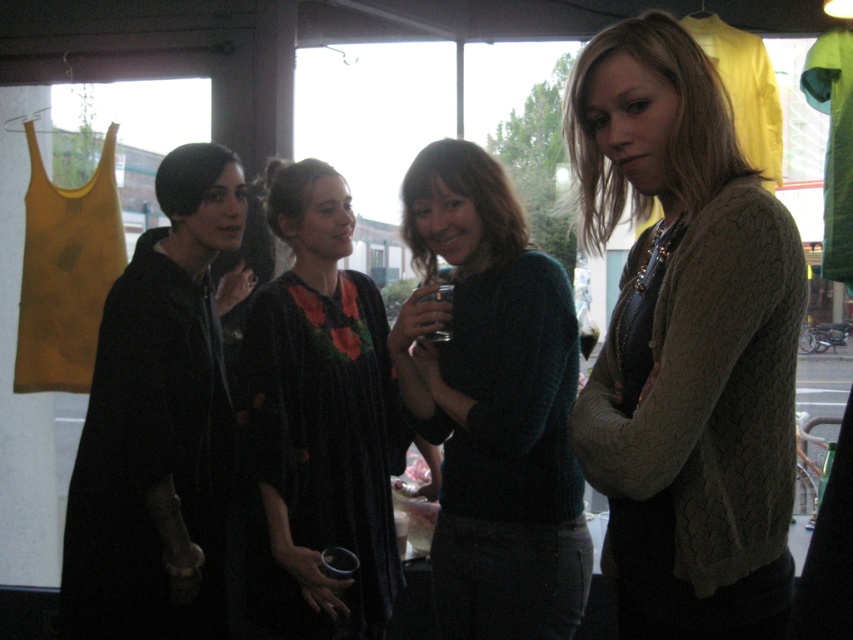
Question: Which object is positioned farthest from the metallic silver cup at center?

Choices:
 (A) knitted teal sweater at center
 (B) cable-knit sweater at center

Answer: (B)

Question: Which point is closer to the camera?

Choices:
 (A) velvet black dress at center
 (B) knitted teal sweater at center

Answer: (B)

Question: Does velvet black dress at center have a lesser width compared to metallic silver cup at center?

Choices:
 (A) yes
 (B) no

Answer: (B)

Question: Does knitted teal sweater at center have a larger size compared to black matte coat at left?

Choices:
 (A) no
 (B) yes

Answer: (A)

Question: Which object appears closest to the camera in this image?

Choices:
 (A) velvet black dress at center
 (B) knitted teal sweater at center
 (C) black matte coat at left

Answer: (B)

Question: Considering the relative positions of velvet black dress at center and metallic silver cup at center in the image provided, where is velvet black dress at center located with respect to metallic silver cup at center?

Choices:
 (A) right
 (B) left

Answer: (B)